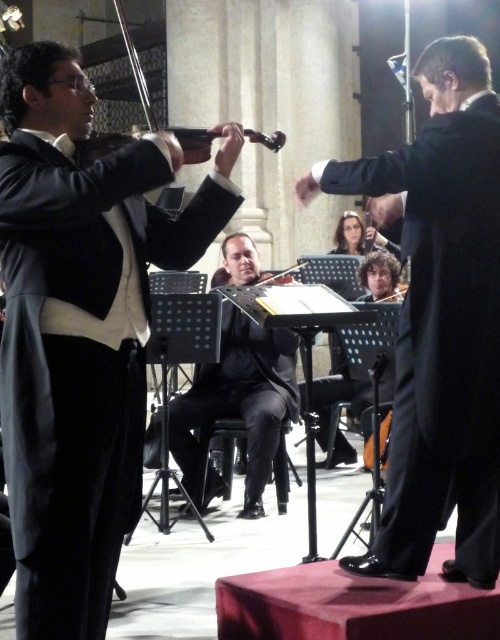
Does matte black violin at left appear on the right side of curly-haired man at center?

Incorrect, matte black violin at left is not on the right side of curly-haired man at center.

Is the position of matte black violin at left less distant than that of curly-haired man at center?

Yes, matte black violin at left is closer to the viewer.

Identify the location of matte black violin at left. This screenshot has width=500, height=640. (81, 328).

Where is `matte black violin at left`? matte black violin at left is located at coordinates (81, 328).

Who is positioned more to the right, shiny black violin at left or curly-haired man at center?

curly-haired man at center

Can you confirm if shiny black violin at left is positioned above curly-haired man at center?

Yes, shiny black violin at left is above curly-haired man at center.

This screenshot has width=500, height=640. What do you see at coordinates (129, 74) in the screenshot?
I see `shiny black violin at left` at bounding box center [129, 74].

Locate an element on the screen. The height and width of the screenshot is (640, 500). shiny black violin at left is located at coordinates (129, 74).

Is black smooth suit at center further to the viewer compared to wooden violin at center?

That is False.

Looking at this image, who is positioned more to the left, black smooth suit at center or wooden violin at center?

wooden violin at center is more to the left.

Does point (176, 460) lie in front of point (225, 282)?

Yes, it is.

Where is `black smooth suit at center`? This screenshot has width=500, height=640. black smooth suit at center is located at coordinates (240, 401).